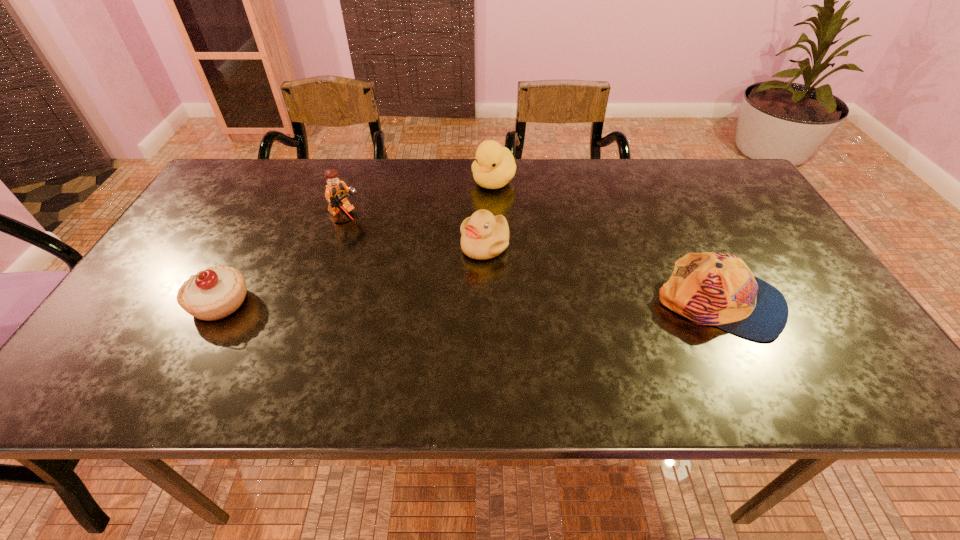
Locate an element on the screen. object positioned at the left edge is located at coordinates (212, 294).

Where is `object situated at the right edge`? The width and height of the screenshot is (960, 540). object situated at the right edge is located at coordinates (710, 288).

Identify the location of object at the near left corner. (212, 294).

Where is `object that is at the near right corner`? object that is at the near right corner is located at coordinates (710, 288).

In the image, there is a desktop. At what (x,y) coordinates should I click in order to perform the action: click on vacant space at the far edge. Please return your answer as a coordinate pair (x, y). Looking at the image, I should click on (516, 180).

Where is `vacant space at the left edge of the desktop`? The width and height of the screenshot is (960, 540). vacant space at the left edge of the desktop is located at coordinates (182, 264).

Locate an element on the screen. The image size is (960, 540). vacant area at the right edge of the desktop is located at coordinates (737, 243).

Identify the location of vacant space at the far left corner of the desktop. (271, 177).

Where is `vacant space at the far right corner of the desktop`? The height and width of the screenshot is (540, 960). vacant space at the far right corner of the desktop is located at coordinates (743, 204).

This screenshot has width=960, height=540. What are the coordinates of `free space between the farthest object and the rightmost object` in the screenshot? It's located at (607, 243).